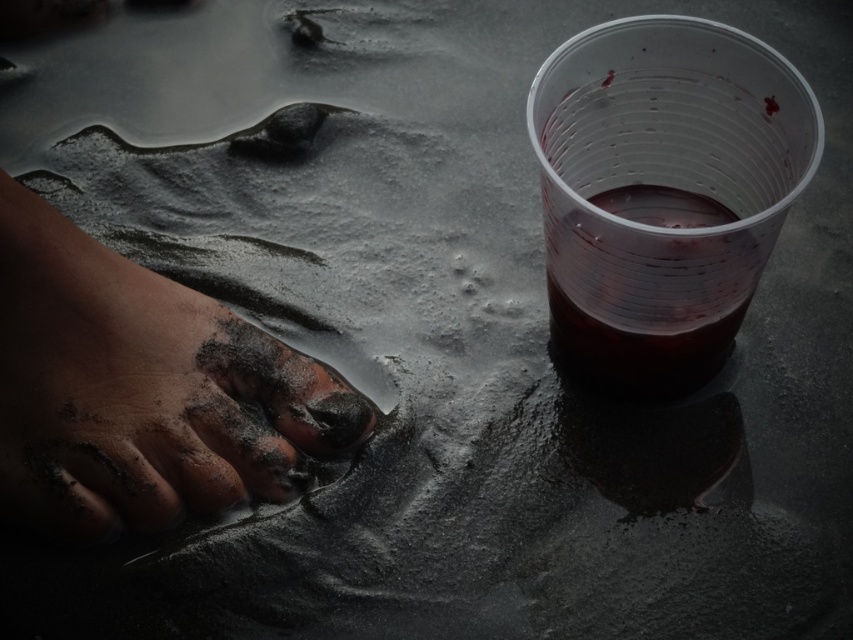
Is transparent plastic cup at upper right above translucent plastic cup at upper right?

Yes.

Looking at this image, how distant is transparent plastic cup at upper right from translucent plastic cup at upper right?

transparent plastic cup at upper right and translucent plastic cup at upper right are 1.40 inches apart from each other.

Describe the element at coordinates (663, 189) in the screenshot. The height and width of the screenshot is (640, 853). I see `transparent plastic cup at upper right` at that location.

You are a GUI agent. You are given a task and a screenshot of the screen. Output one action in this format:
    pyautogui.click(x=<x>, y=<y>)
    Task: Click on the transparent plastic cup at upper right
    The height and width of the screenshot is (640, 853).
    Given the screenshot: What is the action you would take?
    pyautogui.click(x=663, y=189)

Between point (231, 378) and point (596, 324), which one is positioned in front?

Point (596, 324) is in front.

Between dusty skin foot at lower left and translucent plastic cup at upper right, which one appears on the left side from the viewer's perspective?

Positioned to the left is dusty skin foot at lower left.

Is point (131, 260) positioned after point (692, 204)?

No, it is in front of (692, 204).

Where is `dusty skin foot at lower left`? Image resolution: width=853 pixels, height=640 pixels. dusty skin foot at lower left is located at coordinates (141, 390).

From the picture: Does transparent plastic cup at upper right have a lesser height compared to dusty skin foot at lower left?

No.

Does point (619, 42) come closer to viewer compared to point (314, 380)?

Yes, point (619, 42) is in front of point (314, 380).

The width and height of the screenshot is (853, 640). I want to click on transparent plastic cup at upper right, so click(x=663, y=189).